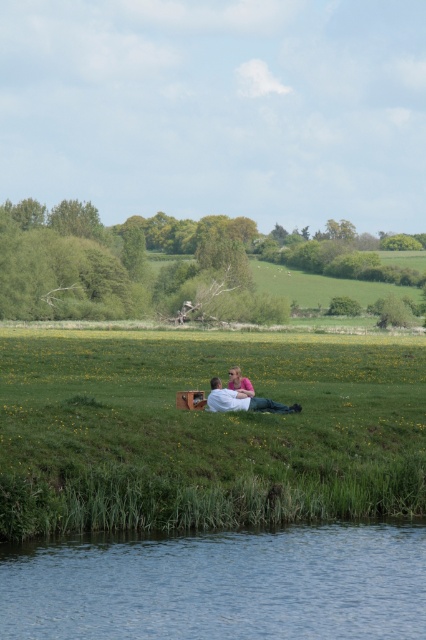
Does white fabric at center have a greater width compared to pink fabric at center?

Yes.

Which is behind, point (232, 401) or point (233, 374)?

The point (233, 374) is behind.

At what (x,y) coordinates should I click in order to perform the action: click on white fabric at center. Please return your answer as a coordinate pair (x, y). This screenshot has height=640, width=426. Looking at the image, I should click on (242, 401).

Is blue water at lower center positioned at the back of white fabric at center?

No, blue water at lower center is closer to the viewer.

Which is above, blue water at lower center or white fabric at center?

white fabric at center is higher up.

Measure the distance between blue water at lower center and camera.

blue water at lower center is 42.48 feet from camera.

Image resolution: width=426 pixels, height=640 pixels. Identify the location of blue water at lower center. (221, 584).

Is green grassy hillside at center further to camera compared to pink fabric at center?

No.

Where is `green grassy hillside at center`? The width and height of the screenshot is (426, 640). green grassy hillside at center is located at coordinates (204, 429).